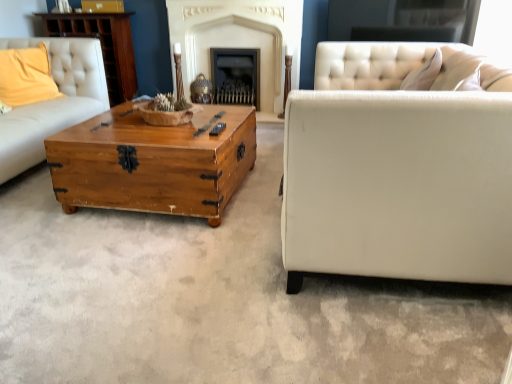
Question: Which direction should I rotate to look at smooth stone fireplace at center, the 2th fireplace when ordered from right to left?

Choices:
 (A) right
 (B) left

Answer: (B)

Question: From a real-world perspective, is wooden dresser at upper left positioned over wooden trunk at center based on gravity?

Choices:
 (A) no
 (B) yes

Answer: (B)

Question: Can you confirm if wooden dresser at upper left is wider than wooden trunk at center?

Choices:
 (A) no
 (B) yes

Answer: (A)

Question: Does wooden dresser at upper left have a greater height compared to wooden trunk at center?

Choices:
 (A) yes
 (B) no

Answer: (A)

Question: Does wooden dresser at upper left turn towards wooden trunk at center?

Choices:
 (A) yes
 (B) no

Answer: (B)

Question: Is wooden dresser at upper left looking in the opposite direction of wooden trunk at center?

Choices:
 (A) yes
 (B) no

Answer: (B)

Question: Is wooden dresser at upper left completely or partially outside of wooden trunk at center?

Choices:
 (A) no
 (B) yes

Answer: (B)

Question: Considering the relative sizes of yellow fabric pillow at upper left and black matte fireplace at center, the 2th fireplace positioned from the left, in the image provided, is yellow fabric pillow at upper left smaller than black matte fireplace at center, the 2th fireplace positioned from the left,?

Choices:
 (A) yes
 (B) no

Answer: (B)

Question: Is yellow fabric pillow at upper left to the right of black matte fireplace at center, the 2th fireplace positioned from the left, from the viewer's perspective?

Choices:
 (A) yes
 (B) no

Answer: (B)

Question: From a real-world perspective, is yellow fabric pillow at upper left positioned over black matte fireplace at center, the 2th fireplace positioned from the left, based on gravity?

Choices:
 (A) no
 (B) yes

Answer: (B)

Question: Considering the relative sizes of yellow fabric pillow at upper left and black matte fireplace at center, the 2th fireplace positioned from the left, in the image provided, is yellow fabric pillow at upper left shorter than black matte fireplace at center, the 2th fireplace positioned from the left,?

Choices:
 (A) no
 (B) yes

Answer: (B)

Question: Can you confirm if yellow fabric pillow at upper left is bigger than black matte fireplace at center, the 2th fireplace positioned from the left?

Choices:
 (A) yes
 (B) no

Answer: (A)

Question: Is yellow fabric pillow at upper left oriented towards black matte fireplace at center, the first fireplace in the right-to-left sequence?

Choices:
 (A) no
 (B) yes

Answer: (A)

Question: Are yellow fabric pillow at upper left and wooden dresser at upper left far apart?

Choices:
 (A) yes
 (B) no

Answer: (B)